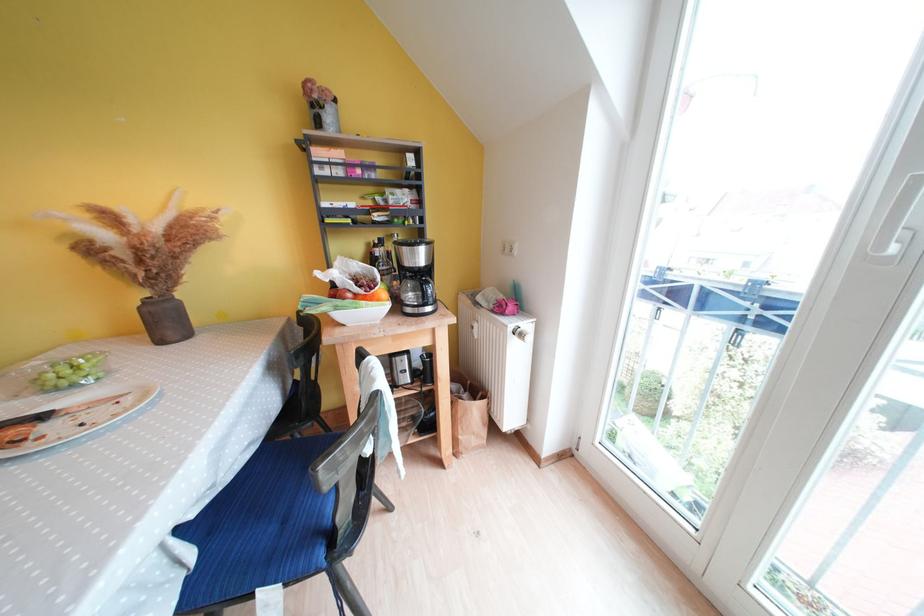
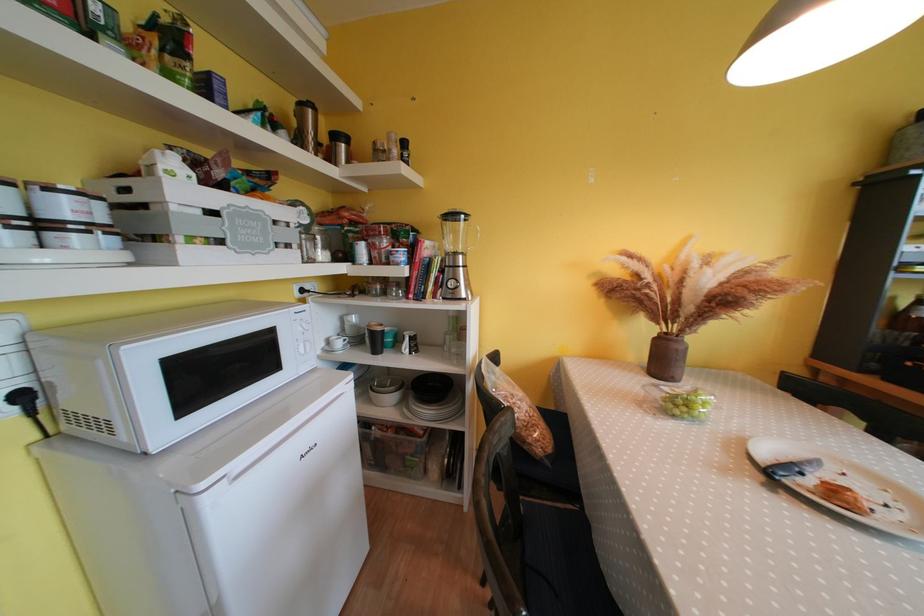
Find the pixel in the second image that matches point (159, 313) in the first image.

(687, 351)